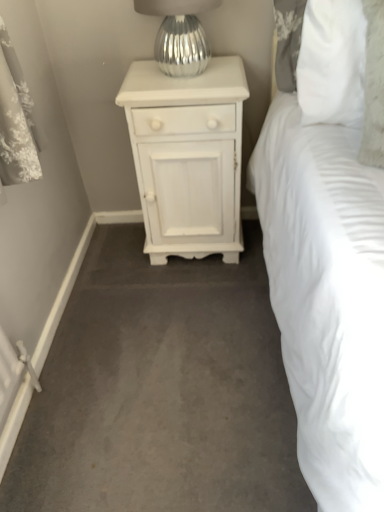
Find the location of a particular element. vacant space that is to the left of white painted wood nightstand at center is located at coordinates (114, 260).